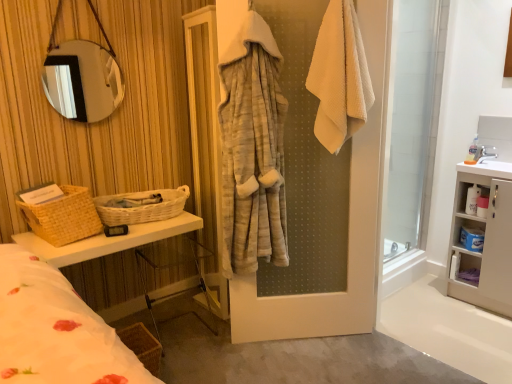
Question: Is white plastic cabinet at right, which ranks as the 1th cabinet in top-to-bottom order, facing away from white matte cabinet at right?

Choices:
 (A) yes
 (B) no

Answer: (A)

Question: Considering the relative positions of white plastic cabinet at right, which is the 2th cabinet from bottom to top, and white matte cabinet at right in the image provided, is white plastic cabinet at right, which is the 2th cabinet from bottom to top, behind white matte cabinet at right?

Choices:
 (A) yes
 (B) no

Answer: (A)

Question: Is white plastic cabinet at right, which is the 2th cabinet from bottom to top, surrounding white matte cabinet at right?

Choices:
 (A) no
 (B) yes

Answer: (A)

Question: Is white plastic cabinet at right, which is the 2th cabinet from bottom to top, outside of white matte cabinet at right?

Choices:
 (A) no
 (B) yes

Answer: (A)

Question: Is white plastic cabinet at right, which ranks as the 1th cabinet in top-to-bottom order, facing towards white matte cabinet at right?

Choices:
 (A) yes
 (B) no

Answer: (A)

Question: In terms of height, does white glossy sink at upper right look taller or shorter compared to brown woven basket at lower left, which ranks as the 3th basket in left-to-right order?

Choices:
 (A) short
 (B) tall

Answer: (A)

Question: Does point (481, 163) appear closer or farther from the camera than point (156, 360)?

Choices:
 (A) closer
 (B) farther

Answer: (B)

Question: Which is correct: white glossy sink at upper right is inside brown woven basket at lower left, the 1th basket when ordered from right to left, or outside of it?

Choices:
 (A) outside
 (B) inside

Answer: (A)

Question: Is white glossy sink at upper right wider or thinner than brown woven basket at lower left, the 1th basket when ordered from right to left?

Choices:
 (A) wide
 (B) thin

Answer: (B)

Question: Is brown woven basket at lower left, acting as the third basket starting from the top, inside or outside of woven wicker vanity at left?

Choices:
 (A) inside
 (B) outside

Answer: (B)

Question: Is brown woven basket at lower left, acting as the 1th basket starting from the bottom, bigger or smaller than woven wicker vanity at left?

Choices:
 (A) small
 (B) big

Answer: (A)

Question: Is brown woven basket at lower left, which ranks as the 3th basket in left-to-right order, taller or shorter than woven wicker vanity at left?

Choices:
 (A) short
 (B) tall

Answer: (A)

Question: From the image's perspective, is brown woven basket at lower left, which ranks as the 3th basket in left-to-right order, located above or below woven wicker vanity at left?

Choices:
 (A) above
 (B) below

Answer: (B)

Question: Is brown woven basket at lower left, which ranks as the 3th basket in left-to-right order, taller or shorter than transparent glass screen door at right?

Choices:
 (A) tall
 (B) short

Answer: (B)

Question: Is brown woven basket at lower left, the 1th basket when ordered from right to left, bigger or smaller than transparent glass screen door at right?

Choices:
 (A) small
 (B) big

Answer: (A)